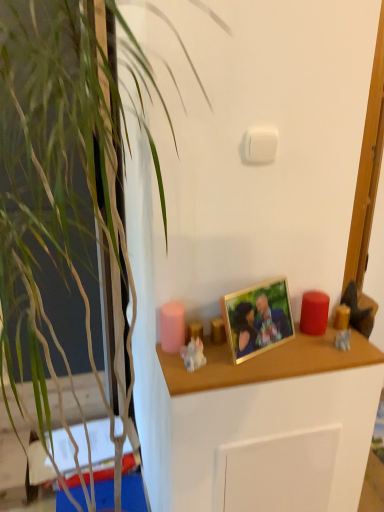
Find the location of a particular element. This screenshot has height=512, width=384. empty space that is in between translucent plastic figurine at right, placed as the 1th toy when sorted from back to front, and pink matte candle at center, positioned as the 1th candle in left-to-right order is located at coordinates (273, 347).